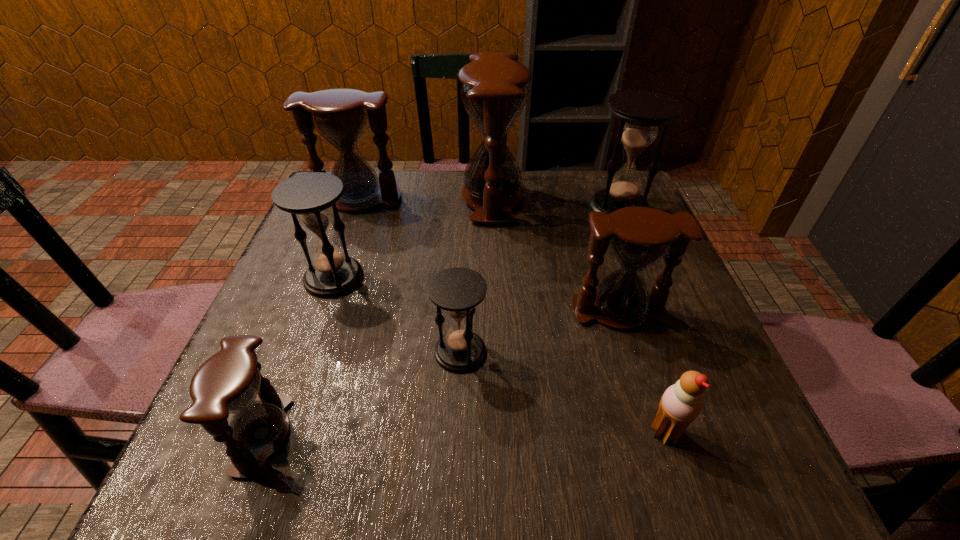
Find the location of `blank region between the icecream and the second nearest black hourglass`. blank region between the icecream and the second nearest black hourglass is located at coordinates (500, 355).

I want to click on free space between the nearest hourglass and the biggest brown hourglass, so click(377, 316).

The height and width of the screenshot is (540, 960). What are the coordinates of `empty space between the third farthest brown hourglass and the icecream` in the screenshot? It's located at (642, 372).

This screenshot has height=540, width=960. I want to click on the seventh closest object to the smallest brown hourglass, so click(x=640, y=112).

Where is `the second closest object to the rightmost brown hourglass`? the second closest object to the rightmost brown hourglass is located at coordinates (681, 403).

At what (x,y) coordinates should I click in order to perform the action: click on hourglass object that ranks as the third closest to the second black hourglass from left to right. Please return your answer as a coordinate pair (x, y). The width and height of the screenshot is (960, 540). Looking at the image, I should click on [x=228, y=382].

In order to click on the closest hourglass to the rightmost black hourglass in this screenshot , I will do `click(494, 92)`.

Where is `brown hourglass that is the third closest to the biggest black hourglass`? This screenshot has height=540, width=960. brown hourglass that is the third closest to the biggest black hourglass is located at coordinates (340, 115).

Locate which brown hourglass ranks second in proximity to the third farthest brown hourglass. Please provide its 2D coordinates. Your answer should be formatted as a tuple, i.e. [(x, y)], where the tuple contains the x and y coordinates of a point satisfying the conditions above.

[(340, 115)]

What are the coordinates of `black hourglass that stands as the closest to the third smallest brown hourglass` in the screenshot? It's located at [x=310, y=197].